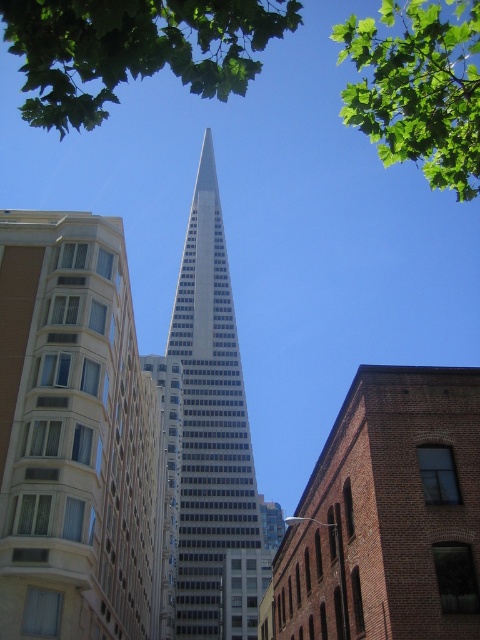
Can you confirm if beige brick building at left is positioned to the left of red brick building at center?

Indeed, beige brick building at left is positioned on the left side of red brick building at center.

Does point (63, 298) lie in front of point (463, 484)?

No.

Where is `beige brick building at left`? Image resolution: width=480 pixels, height=640 pixels. beige brick building at left is located at coordinates (75, 436).

Between red brick building at center and green leafy tree at upper right, which one appears on the right side from the viewer's perspective?

Positioned to the right is green leafy tree at upper right.

I want to click on red brick building at center, so click(x=388, y=515).

Does silver glass skyscraper at center appear over green leafy tree at upper center?

Actually, silver glass skyscraper at center is below green leafy tree at upper center.

Between silver glass skyscraper at center and green leafy tree at upper center, which one is positioned lower?

silver glass skyscraper at center is lower down.

Find the location of a particular element. The image size is (480, 640). silver glass skyscraper at center is located at coordinates (210, 442).

I want to click on silver glass skyscraper at center, so click(x=210, y=442).